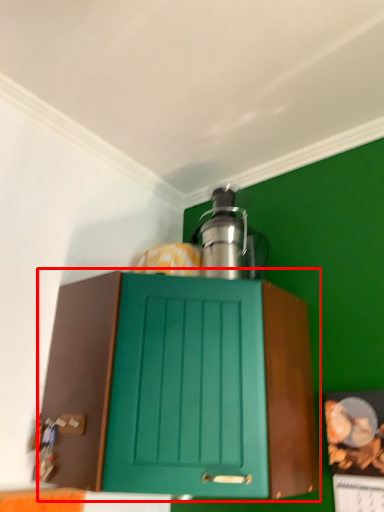
Question: From the image's perspective, what is the correct spatial relationship of cabinetry (annotated by the red box) in relation to kitchen appliance?

Choices:
 (A) below
 (B) above

Answer: (A)